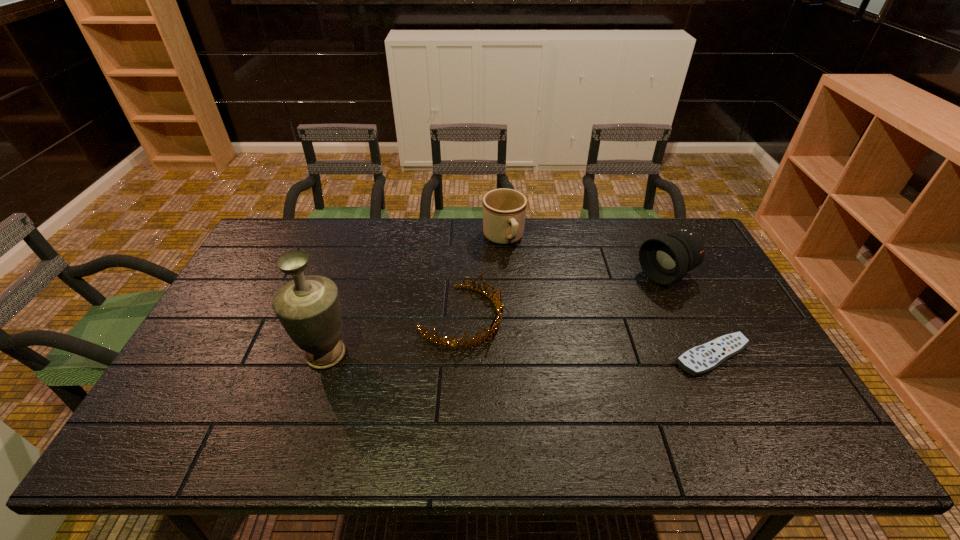
I want to click on vacant region between the urn and the shortest object, so click(518, 355).

Where is `free space between the telephoto lens and the tiara`? The height and width of the screenshot is (540, 960). free space between the telephoto lens and the tiara is located at coordinates (563, 296).

Identify the location of free space that is in between the mug and the telephoto lens. (585, 257).

This screenshot has width=960, height=540. I want to click on free area in between the remote control and the second shortest object, so click(587, 336).

I want to click on free point between the shortest object and the telephoto lens, so click(x=688, y=315).

The image size is (960, 540). What are the coordinates of `free space between the telephoto lens and the fourth tallest object` in the screenshot? It's located at (563, 296).

The height and width of the screenshot is (540, 960). Find the location of `empty space that is in between the telephoto lens and the shortest object`. empty space that is in between the telephoto lens and the shortest object is located at coordinates (688, 315).

At what (x,y) coordinates should I click in order to perform the action: click on the fourth closest object to the telephoto lens. Please return your answer as a coordinate pair (x, y). Looking at the image, I should click on (308, 307).

Locate an element on the screen. Image resolution: width=960 pixels, height=540 pixels. object that is the nearest to the urn is located at coordinates (474, 341).

You are a GUI agent. You are given a task and a screenshot of the screen. Output one action in this format:
    pyautogui.click(x=<x>, y=<y>)
    Task: Click on the vacant space that satisfies the following two spatial constraints: 1. on the front side of the farthest object; 2. on the left side of the remote control
    This screenshot has width=960, height=540.
    Given the screenshot: What is the action you would take?
    pyautogui.click(x=512, y=356)